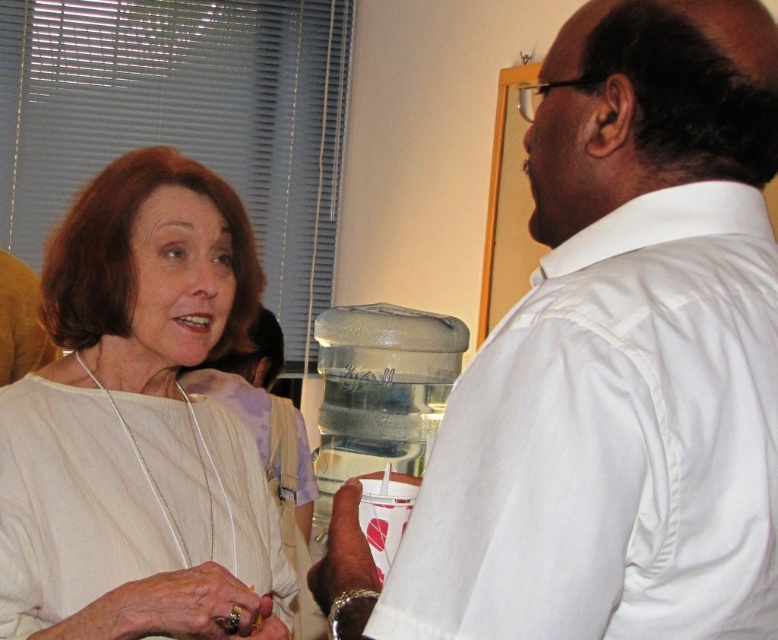
Question: Can you confirm if white smooth shirt at right is smaller than brown leather wristband at lower center?

Choices:
 (A) yes
 (B) no

Answer: (B)

Question: Can you confirm if white matte necklace at upper left is positioned to the right of gold metallic ring at lower left?

Choices:
 (A) yes
 (B) no

Answer: (B)

Question: Considering the real-world distances, which object is farthest from the gold metallic ring at lower left?

Choices:
 (A) white matte necklace at upper left
 (B) white smooth shirt at right

Answer: (B)

Question: Is white matte necklace at upper left closer to the viewer compared to brown leather wristband at lower center?

Choices:
 (A) yes
 (B) no

Answer: (B)

Question: Estimate the real-world distances between objects in this image. Which object is closer to the gold metallic ring at lower left?

Choices:
 (A) brown leather wristband at lower center
 (B) white matte necklace at upper left
 (C) white smooth shirt at right

Answer: (A)

Question: Among these points, which one is nearest to the camera?

Choices:
 (A) (27, 529)
 (B) (342, 556)
 (C) (759, 529)
 (D) (258, 616)

Answer: (C)